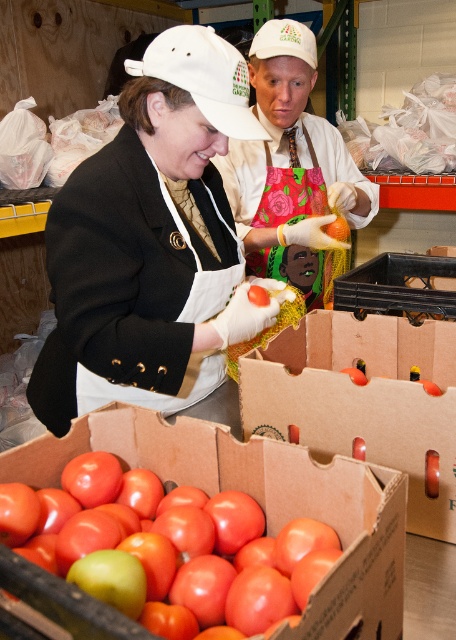
Question: Considering the real-world distances, which object is farthest from the white matte apron at center?

Choices:
 (A) cardboard box at lower center
 (B) shiny red tomato at lower left
 (C) matte white cap at upper center

Answer: (C)

Question: Is white matte apron at center below shiny red tomato at lower left?

Choices:
 (A) yes
 (B) no

Answer: (B)

Question: Which object is farther from the camera taking this photo?

Choices:
 (A) matte white cap at upper center
 (B) white matte apron at center
 (C) shiny red tomato at lower left

Answer: (A)

Question: Can you confirm if shiny red tomato at lower left is positioned above cardboard box at lower center?

Choices:
 (A) no
 (B) yes

Answer: (A)

Question: Which point is farther from the camera taking this photo?

Choices:
 (A) (345, 188)
 (B) (451, 408)
 (C) (279, 586)

Answer: (A)

Question: Considering the relative positions of white matte apron at center and shiny red tomato at lower left in the image provided, where is white matte apron at center located with respect to shiny red tomato at lower left?

Choices:
 (A) below
 (B) above

Answer: (B)